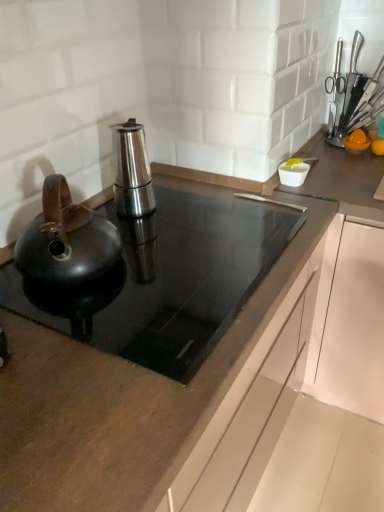
At what (x,y) coordinates should I click in order to perform the action: click on vacant space to the right of stainless steel espresso maker at center, positioned as the second kitchen appliance in front-to-back order. Please return your answer as a coordinate pair (x, y). This screenshot has height=512, width=384. Looking at the image, I should click on (201, 206).